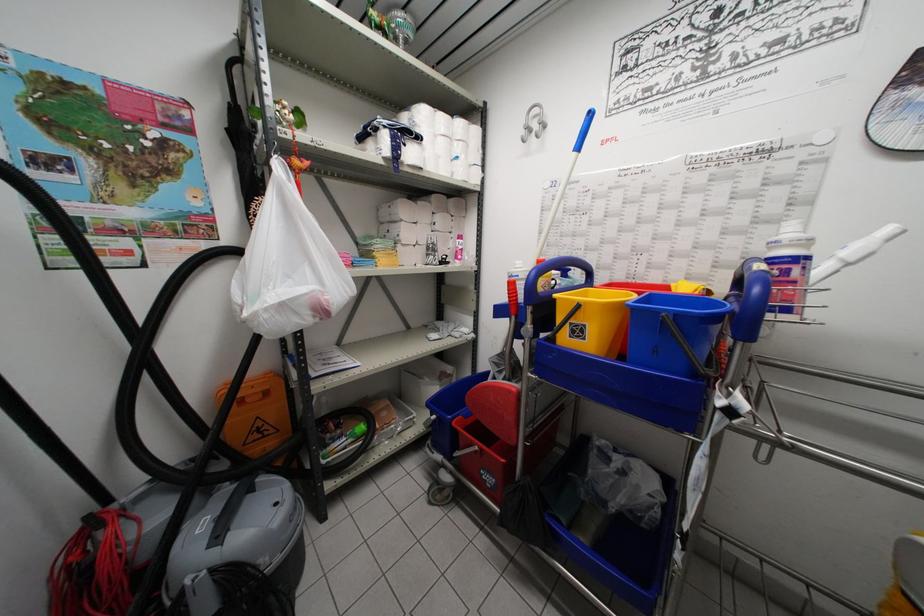
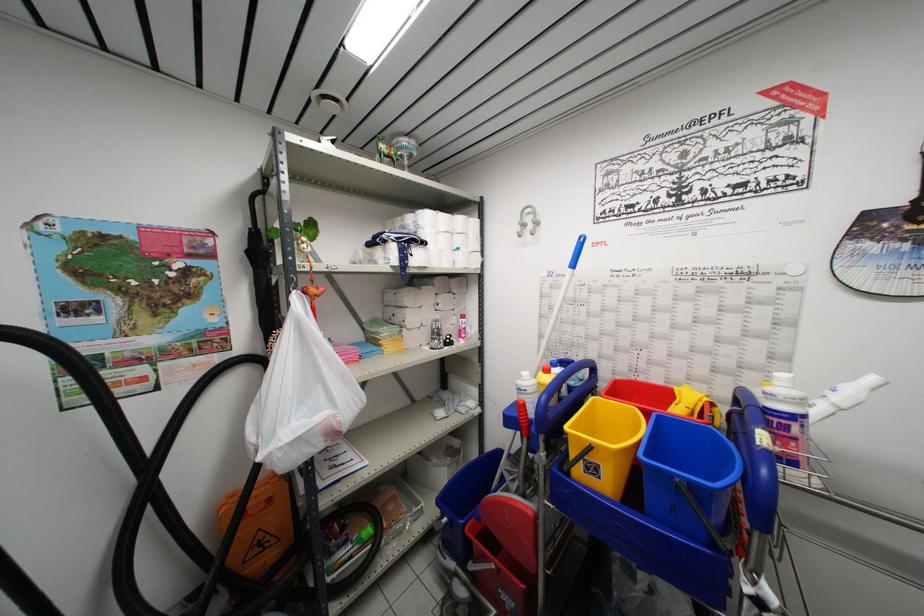
Where in the second image is the point corresponding to point 520,297 from the first image?

(530, 419)